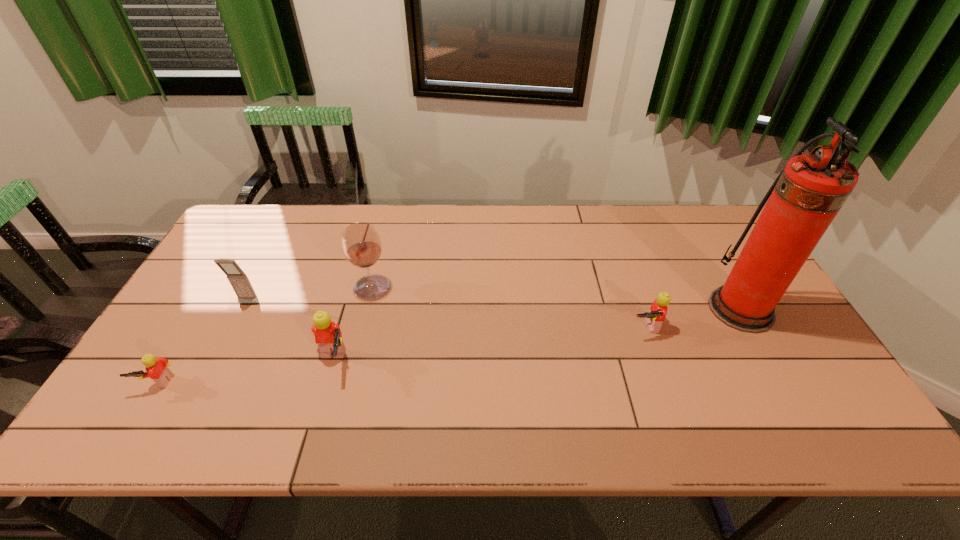
The image size is (960, 540). I want to click on object that is at the near left corner, so click(157, 370).

This screenshot has width=960, height=540. In the image, there is a desktop. What are the coordinates of `vacant space at the far edge` in the screenshot? It's located at (555, 210).

This screenshot has height=540, width=960. In the image, there is a desktop. Identify the location of free space at the near edge. (475, 380).

At what (x,y) coordinates should I click in order to perform the action: click on vacant space at the left edge of the desktop. Please return your answer as a coordinate pair (x, y). Looking at the image, I should click on (241, 306).

This screenshot has height=540, width=960. I want to click on free space at the right edge, so click(802, 353).

This screenshot has height=540, width=960. In the image, there is a desktop. In order to click on vacant space at the far left corner in this screenshot , I will do `click(263, 213)`.

In order to click on free spot between the second Lego from right to left and the fire extinguisher in this screenshot , I will do `click(537, 335)`.

The height and width of the screenshot is (540, 960). Find the location of `free space between the wineglass and the cellular telephone`. free space between the wineglass and the cellular telephone is located at coordinates (310, 295).

The width and height of the screenshot is (960, 540). In order to click on unoccupied area between the rightmost object and the leftmost object in this screenshot , I will do `click(449, 345)`.

Where is `vacant space in between the second shortest object and the second Lego from right to left`? The width and height of the screenshot is (960, 540). vacant space in between the second shortest object and the second Lego from right to left is located at coordinates (488, 345).